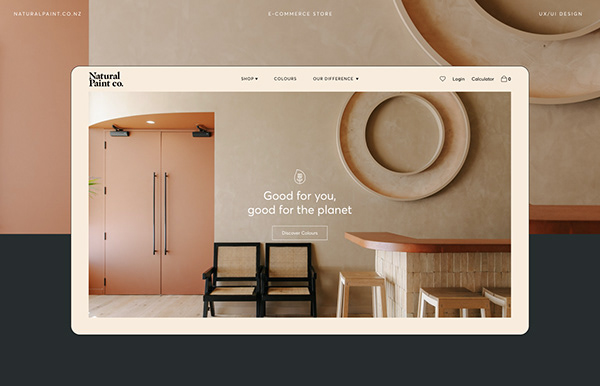
Locate an element on the screen. The width and height of the screenshot is (600, 386). decor on wall is located at coordinates (353, 138).